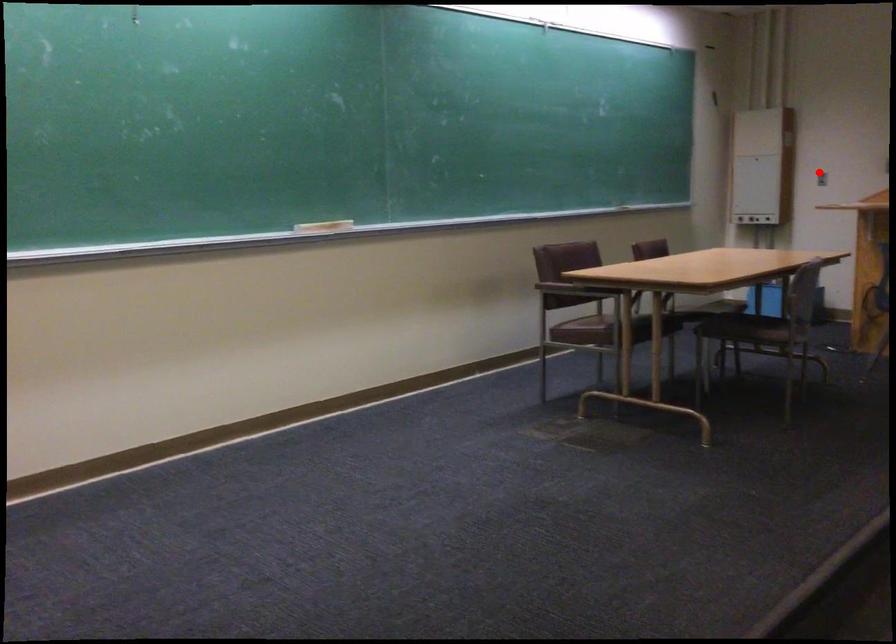
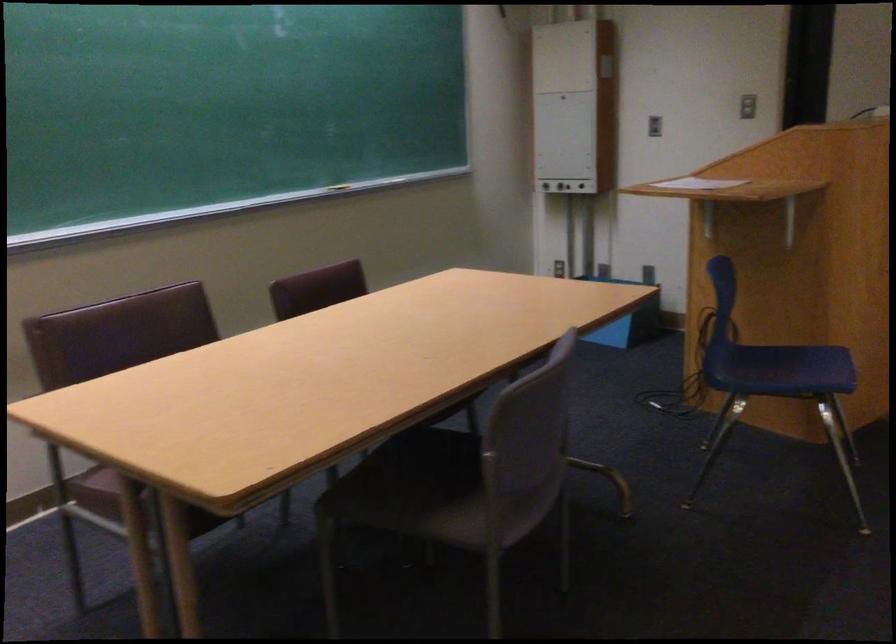
The point at the highlighted location is marked in the first image. Where is the corresponding point in the second image?

(653, 126)